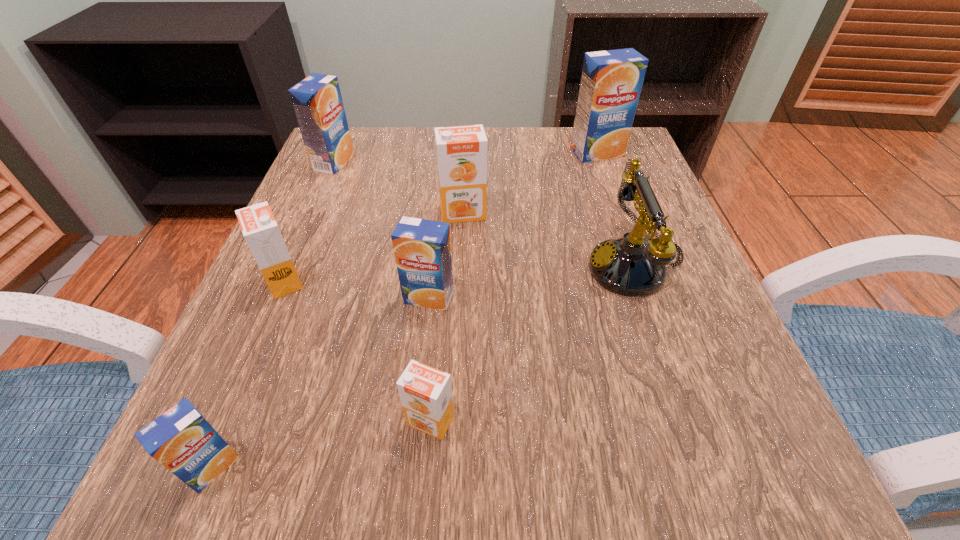
Find the location of a particular element. The image size is (960, 540). free spot at the right edge of the desktop is located at coordinates (611, 237).

Find the location of a particular element. free location at the far left corner of the desktop is located at coordinates pyautogui.click(x=311, y=179).

Locate an element on the screen. The image size is (960, 540). free region at the near left corner of the desktop is located at coordinates (214, 502).

Identify the location of vacant space at the far right corner. The image size is (960, 540). (588, 178).

Locate an element on the screen. vacant region at the near right corner of the desktop is located at coordinates (769, 463).

Locate an element on the screen. The image size is (960, 540). vacant area that lies between the leftmost orange orange juice and the nearest blue orange_juice is located at coordinates (249, 374).

Locate an element on the screen. This screenshot has width=960, height=540. unoccupied area between the smallest orange orange juice and the farthest orange orange juice is located at coordinates (446, 317).

Locate an element on the screen. This screenshot has width=960, height=540. blank region between the rightmost orange_juice and the biggest orange orange juice is located at coordinates (530, 183).

Identify the location of free space between the second nearest orange orange juice and the second biggest blue orange_juice. The image size is (960, 540). (309, 222).

Identify the location of vacant point located between the second blue orange_juice from right to left and the nearest orange orange juice. The image size is (960, 540). (430, 359).